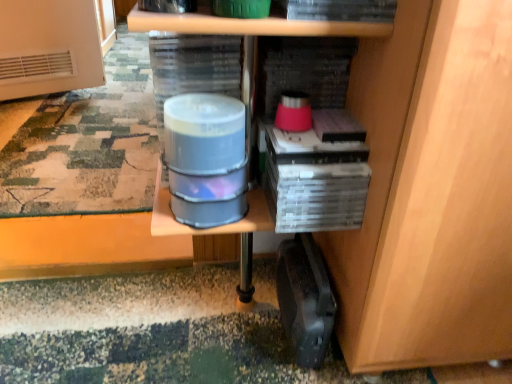
Question: Is translucent plastic water at center not close to camouflage fabric mat at lower left?

Choices:
 (A) yes
 (B) no

Answer: (B)

Question: Is translucent plastic water at center looking in the opposite direction of camouflage fabric mat at lower left?

Choices:
 (A) yes
 (B) no

Answer: (A)

Question: Does translucent plastic water at center come in front of camouflage fabric mat at lower left?

Choices:
 (A) no
 (B) yes

Answer: (B)

Question: From the image's perspective, is translucent plastic water at center under camouflage fabric mat at lower left?

Choices:
 (A) yes
 (B) no

Answer: (A)

Question: Considering the relative sizes of translucent plastic water at center and camouflage fabric mat at lower left in the image provided, is translucent plastic water at center shorter than camouflage fabric mat at lower left?

Choices:
 (A) yes
 (B) no

Answer: (B)

Question: From the image's perspective, is translucent plastic water at center positioned above or below black plastic briefcase at lower right?

Choices:
 (A) below
 (B) above

Answer: (B)

Question: Is translucent plastic water at center taller or shorter than black plastic briefcase at lower right?

Choices:
 (A) short
 (B) tall

Answer: (A)

Question: Choose the correct answer: Is translucent plastic water at center inside black plastic briefcase at lower right or outside it?

Choices:
 (A) inside
 (B) outside

Answer: (B)

Question: From a real-world perspective, is translucent plastic water at center physically located above or below black plastic briefcase at lower right?

Choices:
 (A) above
 (B) below

Answer: (A)

Question: Considering the positions of black plastic briefcase at lower right and camouflage fabric mat at lower left in the image, is black plastic briefcase at lower right bigger or smaller than camouflage fabric mat at lower left?

Choices:
 (A) big
 (B) small

Answer: (B)

Question: In the image, is black plastic briefcase at lower right positioned in front of or behind camouflage fabric mat at lower left?

Choices:
 (A) front
 (B) behind

Answer: (A)

Question: Considering the positions of point (295, 309) and point (93, 173), is point (295, 309) closer or farther from the camera than point (93, 173)?

Choices:
 (A) closer
 (B) farther

Answer: (A)

Question: From a real-world perspective, is black plastic briefcase at lower right above or below camouflage fabric mat at lower left?

Choices:
 (A) above
 (B) below

Answer: (A)

Question: Considering the relative positions of camouflage fabric mat at lower left and black plastic briefcase at lower right in the image provided, is camouflage fabric mat at lower left to the left or to the right of black plastic briefcase at lower right?

Choices:
 (A) left
 (B) right

Answer: (A)

Question: Does point (145, 110) appear closer or farther from the camera than point (308, 264)?

Choices:
 (A) closer
 (B) farther

Answer: (B)